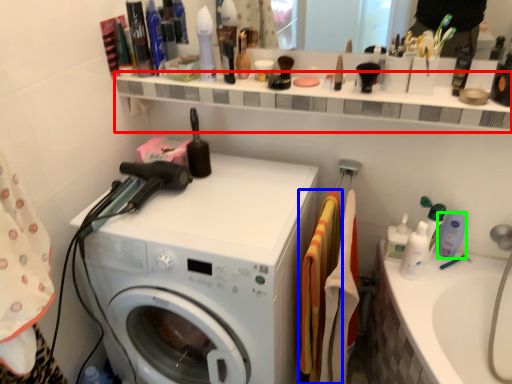
Question: Which object is the closest to the shelve (highlighted by a red box)? Choose among these: material (highlighted by a blue box) or cleaning product (highlighted by a green box).

Choices:
 (A) material
 (B) cleaning product

Answer: (A)